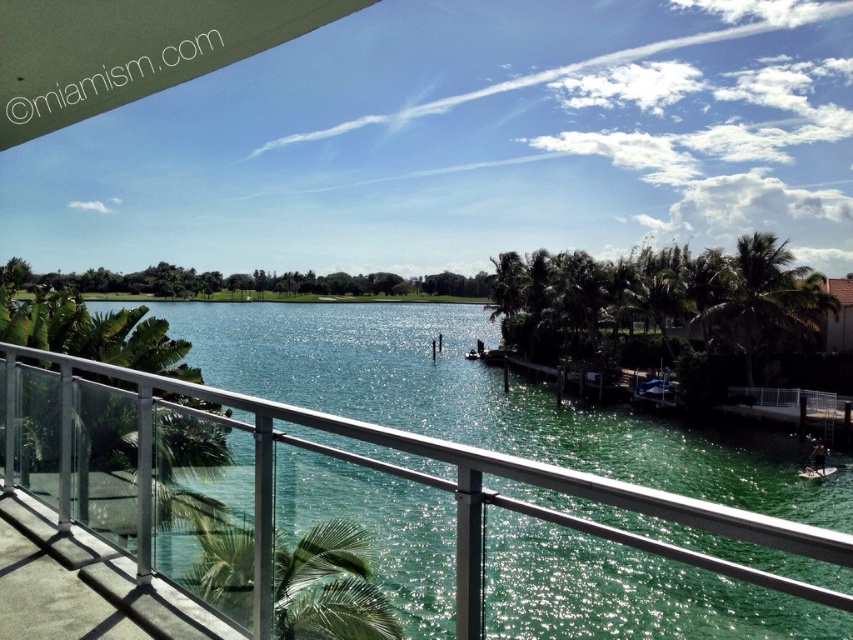
Does clear glass railing at center have a lesser width compared to green leafy palm tree at lower left?

Incorrect, clear glass railing at center's width is not less than green leafy palm tree at lower left's.

Is clear glass railing at center positioned behind green leafy palm tree at lower left?

No, it is in front of green leafy palm tree at lower left.

Where is `clear glass railing at center`? clear glass railing at center is located at coordinates (310, 492).

Measure the distance between point (306, 636) and camera.

A distance of 9.79 feet exists between point (306, 636) and camera.

Can you confirm if clear glass railing at center is taller than white plastic boat at lower right?

Correct, clear glass railing at center is much taller as white plastic boat at lower right.

The height and width of the screenshot is (640, 853). What do you see at coordinates (310, 492) in the screenshot? I see `clear glass railing at center` at bounding box center [310, 492].

Where is `clear glass railing at center`? clear glass railing at center is located at coordinates (310, 492).

Who is taller, clear glass railing at center or green leafy palm tree at right?

With more height is green leafy palm tree at right.

Consider the image. Is clear glass railing at center bigger than green leafy palm tree at right?

Correct, clear glass railing at center is larger in size than green leafy palm tree at right.

The image size is (853, 640). In order to click on clear glass railing at center in this screenshot , I will do `click(310, 492)`.